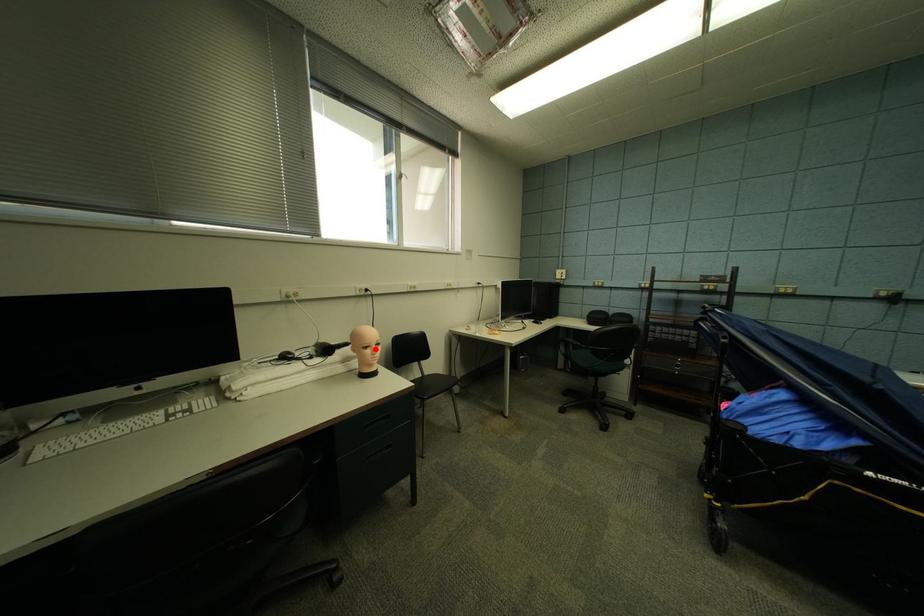
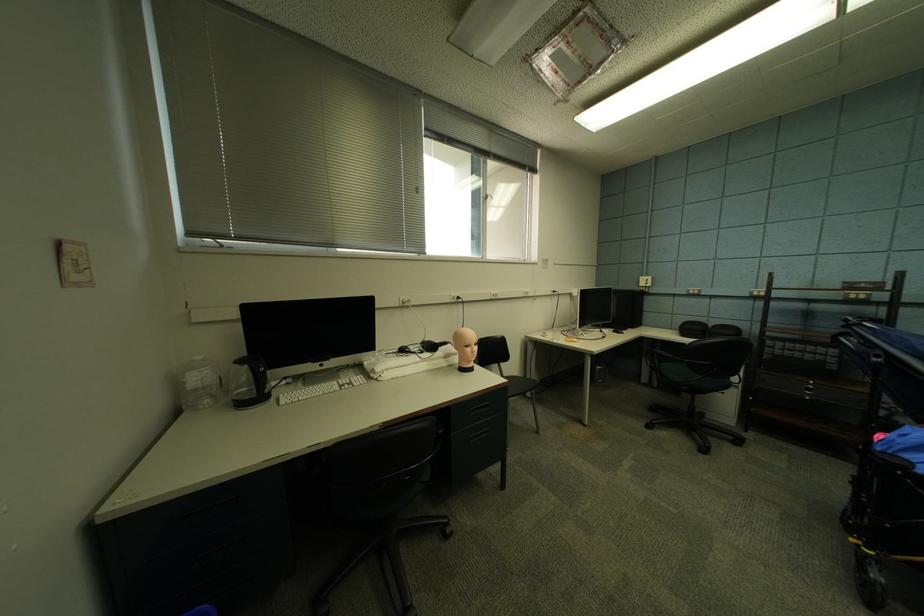
Question: A red point is marked in image1. In image2, is the corresponding 3D point closer to the camera or farther? Reply with the corresponding letter.

Choices:
 (A) The corresponding 3D point is closer.
 (B) The corresponding 3D point is farther.

Answer: (B)